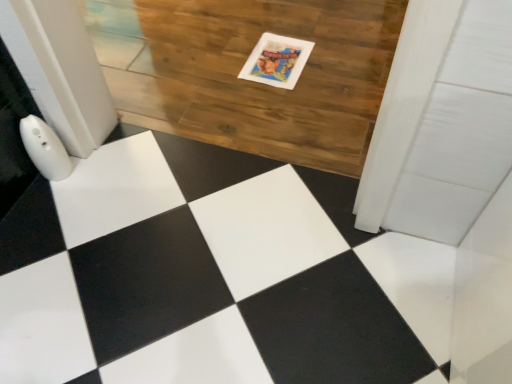
You are a GUI agent. You are given a task and a screenshot of the screen. Output one action in this format:
    pyautogui.click(x=<x>, y=<y>)
    Task: Click on the free spot in front of matte paper postcard at upper center
    The width and height of the screenshot is (512, 384).
    Given the screenshot: What is the action you would take?
    pyautogui.click(x=281, y=101)